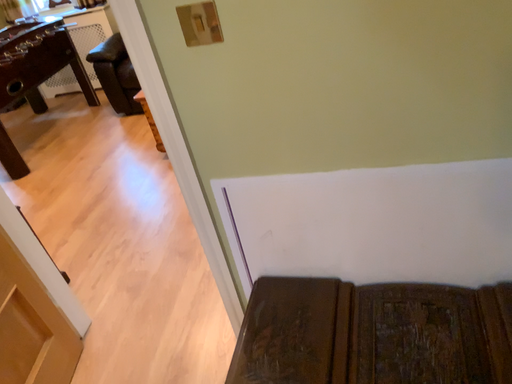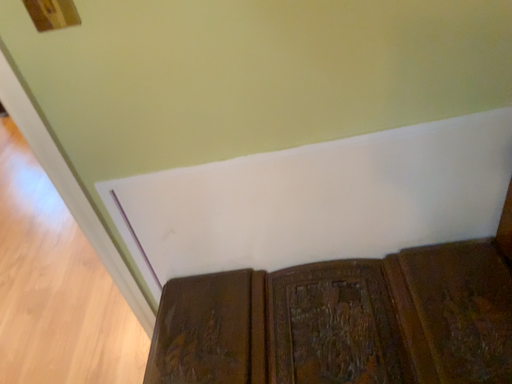
Question: How did the camera likely rotate when shooting the video?

Choices:
 (A) rotated right
 (B) rotated left

Answer: (A)